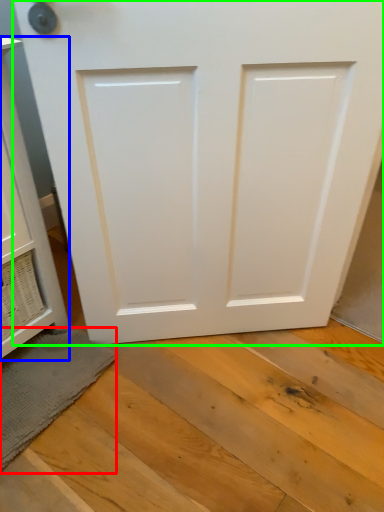
Question: Which is nearer to the bath mat (highlighted by a red box)? cabinetry (highlighted by a blue box) or door (highlighted by a green box).

Choices:
 (A) cabinetry
 (B) door

Answer: (A)